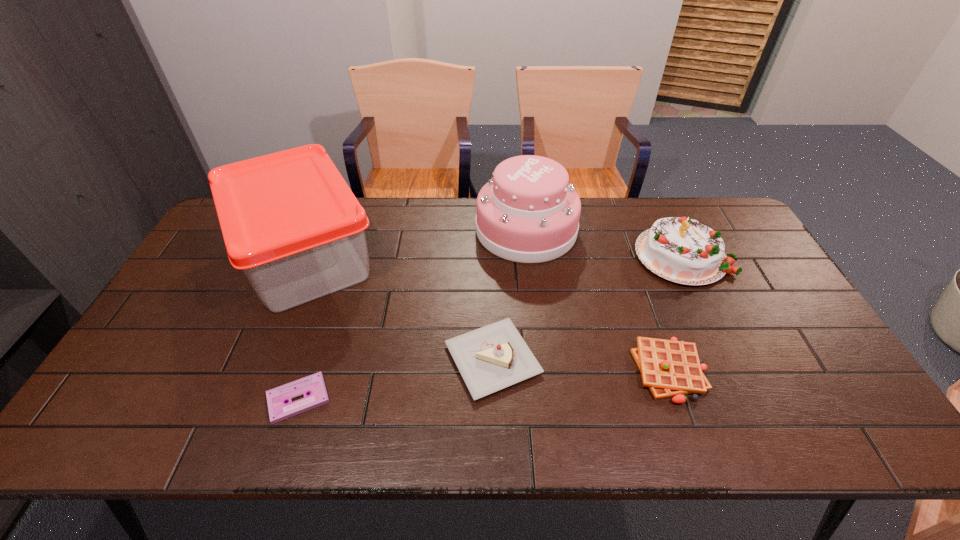
Image resolution: width=960 pixels, height=540 pixels. Find the location of `vacant area located 0.180m on the front of the rightmost cake`. vacant area located 0.180m on the front of the rightmost cake is located at coordinates (721, 338).

Locate an element on the screen. vacant space located on the left of the shortest cake is located at coordinates (365, 359).

Where is `free space located 0.380m on the back of the waffle`? free space located 0.380m on the back of the waffle is located at coordinates (626, 245).

This screenshot has width=960, height=540. What are the coordinates of `blank space located on the back of the videotape` in the screenshot? It's located at (315, 348).

Locate an element on the screen. tray that is at the far edge is located at coordinates (290, 222).

Where is `waffle at the near edge`? waffle at the near edge is located at coordinates (669, 368).

Identify the location of videotape that is at the near edge. (279, 410).

Where is `object positioned at the left edge`? object positioned at the left edge is located at coordinates (290, 222).

Image resolution: width=960 pixels, height=540 pixels. In order to click on object at the right edge in this screenshot , I will do `click(683, 250)`.

Where is `object present at the far left corner`? The image size is (960, 540). object present at the far left corner is located at coordinates (290, 222).